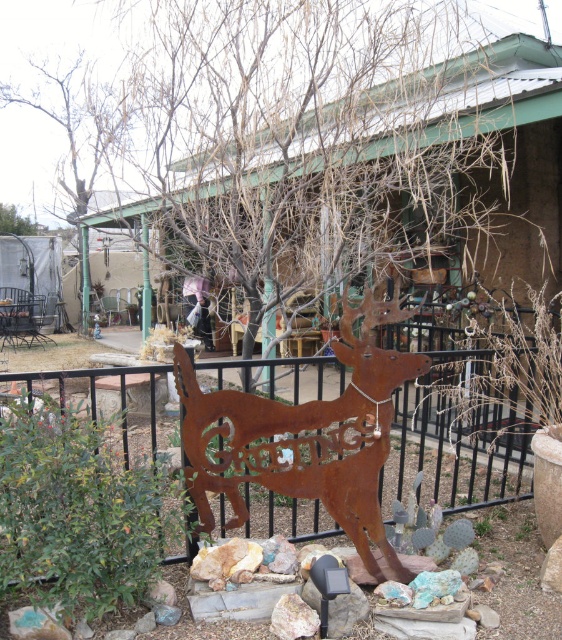
Is point (343, 492) in front of point (26, 221)?

Yes, point (343, 492) is closer to viewer.

Does rusty metal deer at center appear on the right side of brown wood tree at upper left?

Correct, you'll find rusty metal deer at center to the right of brown wood tree at upper left.

Is point (365, 509) more distant than point (19, 220)?

No, it is not.

The image size is (562, 640). I want to click on rusty metal deer at center, so (305, 435).